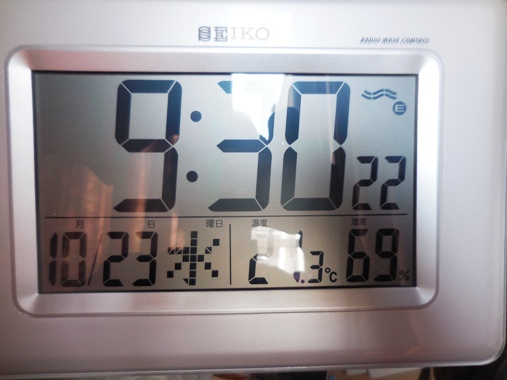
I want to click on frame, so click(x=477, y=175).